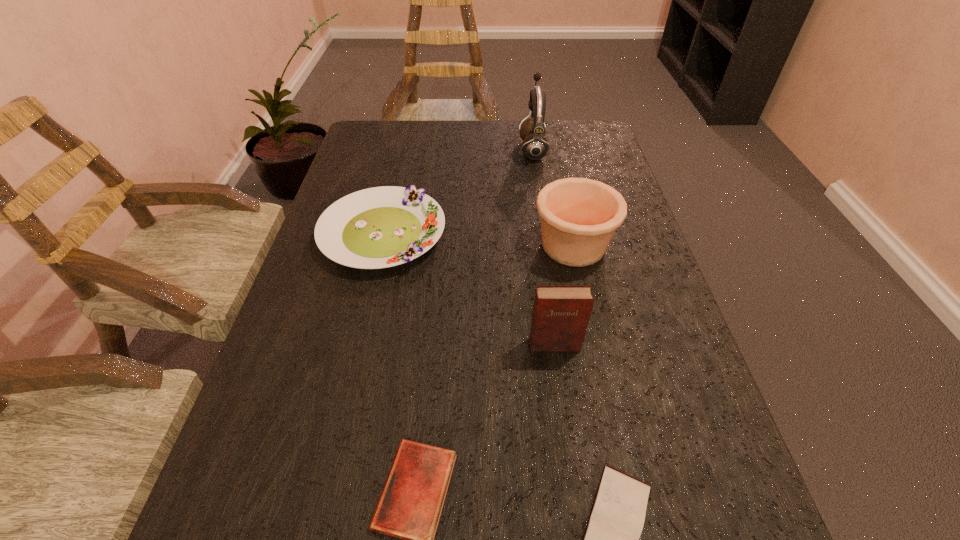
The height and width of the screenshot is (540, 960). Find the location of `vacant space located on the left of the fourth shortest object`. vacant space located on the left of the fourth shortest object is located at coordinates (363, 246).

Identify the location of free space located 0.090m on the front of the salad plate. (365, 312).

Locate an element on the screen. object that is at the far edge is located at coordinates (535, 145).

Find the location of a particular element. object at the left edge is located at coordinates (380, 227).

Identify the location of object present at the right edge. The width and height of the screenshot is (960, 540). (579, 216).

You are a GUI agent. You are given a task and a screenshot of the screen. Output one action in this format:
    pyautogui.click(x=<x>, y=<y>)
    Task: Click on the free region at the far edge of the desktop
    
    Given the screenshot: What is the action you would take?
    pyautogui.click(x=466, y=133)

Find the location of a particular element. vacant region at the left edge of the desktop is located at coordinates (379, 171).

Find the location of a particular element. This screenshot has width=960, height=540. vacant area at the far left corner is located at coordinates (378, 129).

At what (x,y) coordinates should I click in order to perform the action: click on unoccupied area between the salad plate and the tallest diary. Please return your answer as a coordinate pair (x, y). Looking at the image, I should click on (468, 289).

In order to click on free space between the salad plate and the tallest object in this screenshot , I will do `click(458, 192)`.